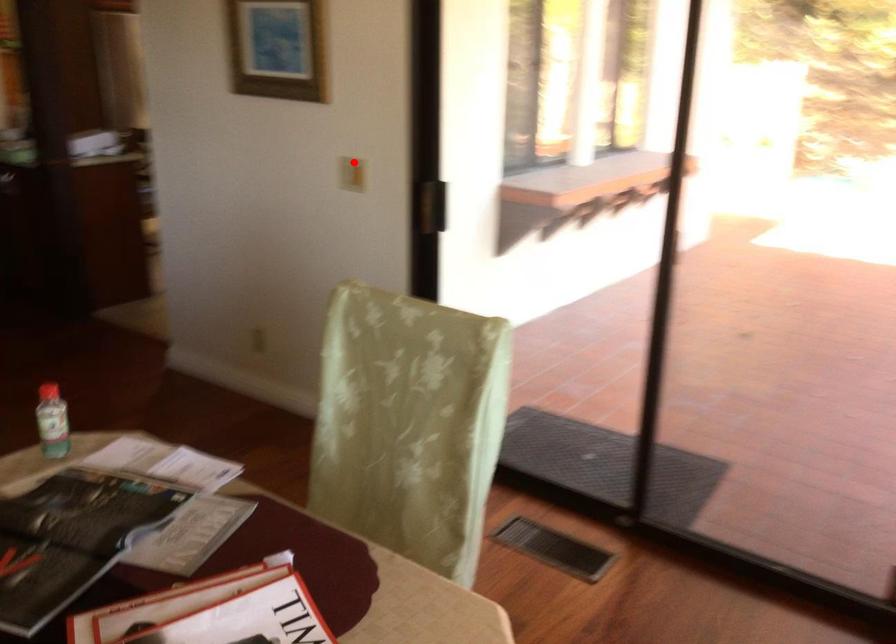
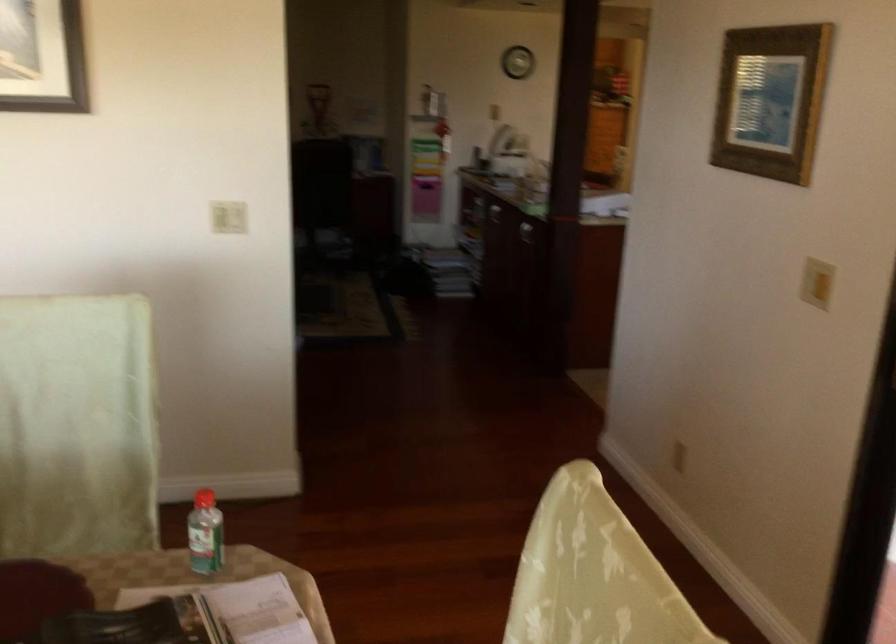
In the second image, find the point that corresponds to the highlighted location in the first image.

(816, 283)